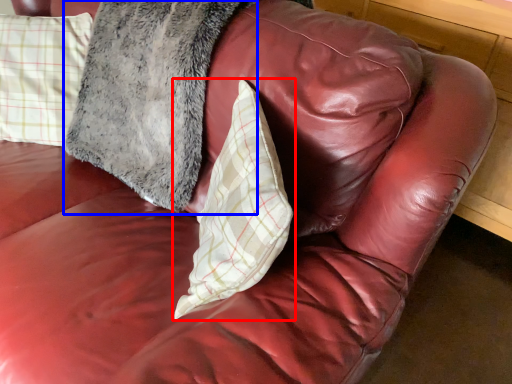
Question: Which object appears closest to the camera in this image, pillow (highlighted by a red box) or pillow (highlighted by a blue box)?

Choices:
 (A) pillow
 (B) pillow

Answer: (A)